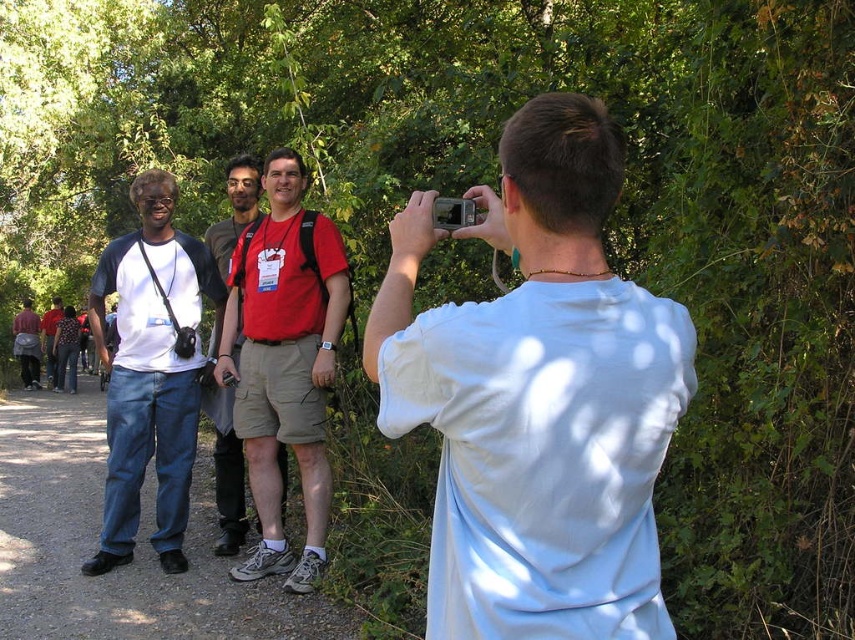
You are a photographer holding a camera and want to capture a clear photo of the white matte shirt at upper right. Based on the scene description, is the subject within the camera focus range of 1.5 meters?

The white matte shirt at upper right is 1.33 meters away from the camera, which is within the 1.5 meters focus range, so yes, the subject is within range.

You are standing at the center of the path in the park scene. You need to locate the white matte shirt at upper right. According to the coordinates provided, where exactly is it positioned?

The white matte shirt at upper right is located at point 0.622 on the horizontal axis and 0.630 on the vertical axis.